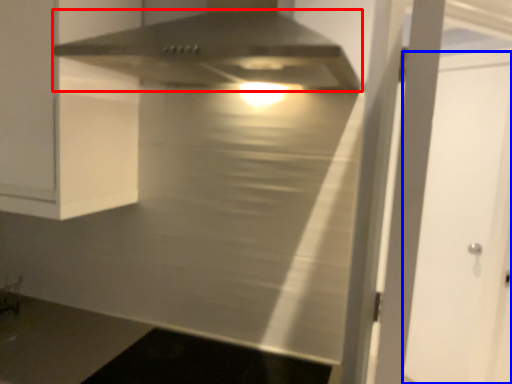
Question: Which object appears farthest to the camera in this image, home appliance (highlighted by a red box) or glass door (highlighted by a blue box)?

Choices:
 (A) home appliance
 (B) glass door

Answer: (B)